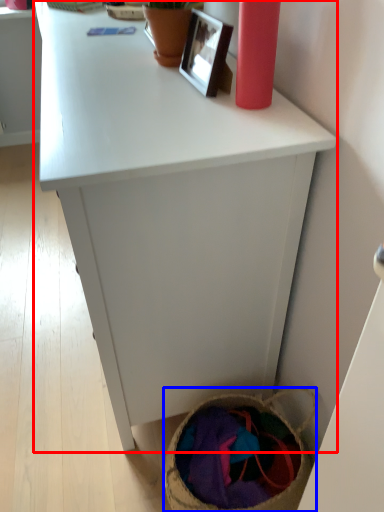
Question: Which point is further to the camera, desk (highlighted by a red box) or basket (highlighted by a blue box)?

Choices:
 (A) desk
 (B) basket

Answer: (B)